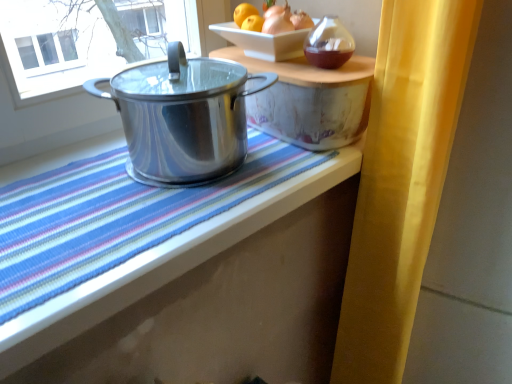
Question: Considering the relative positions of shiny metallic pot at right, acting as the second table starting from the left, and yellow fabric curtain at right in the image provided, is shiny metallic pot at right, acting as the second table starting from the left, to the right of yellow fabric curtain at right from the viewer's perspective?

Choices:
 (A) no
 (B) yes

Answer: (A)

Question: From the image's perspective, does shiny metallic pot at right, acting as the second table starting from the left, appear lower than yellow fabric curtain at right?

Choices:
 (A) no
 (B) yes

Answer: (A)

Question: Does shiny metallic pot at right, acting as the second table starting from the left, have a smaller size compared to yellow fabric curtain at right?

Choices:
 (A) yes
 (B) no

Answer: (A)

Question: From a real-world perspective, is shiny metallic pot at right, acting as the second table starting from the left, on top of yellow fabric curtain at right?

Choices:
 (A) no
 (B) yes

Answer: (B)

Question: Would you say shiny metallic pot at right, acting as the second table starting from the left, is outside yellow fabric curtain at right?

Choices:
 (A) yes
 (B) no

Answer: (A)

Question: Is shiny metallic pot at right, acting as the second table starting from the left, aimed at yellow fabric curtain at right?

Choices:
 (A) yes
 (B) no

Answer: (B)

Question: Are shiny metallic pot at center, which ranks as the first table in left-to-right order, and shiny metallic pot at left far apart?

Choices:
 (A) no
 (B) yes

Answer: (A)

Question: Does shiny metallic pot at center, which ranks as the first table in left-to-right order, appear on the right side of shiny metallic pot at left?

Choices:
 (A) no
 (B) yes

Answer: (A)

Question: Is shiny metallic pot at center, which ranks as the first table in left-to-right order, positioned in front of shiny metallic pot at left?

Choices:
 (A) no
 (B) yes

Answer: (B)

Question: Is shiny metallic pot at center, which ranks as the first table in left-to-right order, facing away from shiny metallic pot at left?

Choices:
 (A) yes
 (B) no

Answer: (B)

Question: Is shiny metallic pot at center, which ranks as the first table in left-to-right order, at the left side of shiny metallic pot at left?

Choices:
 (A) yes
 (B) no

Answer: (A)

Question: Is the depth of shiny metallic pot at center, which ranks as the first table in left-to-right order, greater than that of shiny metallic pot at left?

Choices:
 (A) no
 (B) yes

Answer: (A)

Question: Would you say shiny metallic pot at right, the first table from the right, contains shiny metallic pot at left?

Choices:
 (A) yes
 (B) no

Answer: (B)